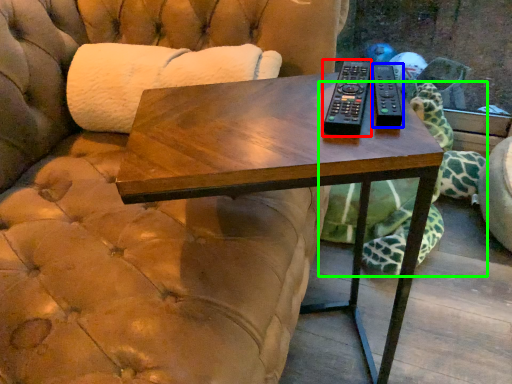
Question: Estimate the real-world distances between objects in this image. Which object is farther from remote (highlighted by a red box), remote (highlighted by a blue box) or tortoise (highlighted by a green box)?

Choices:
 (A) remote
 (B) tortoise

Answer: (B)